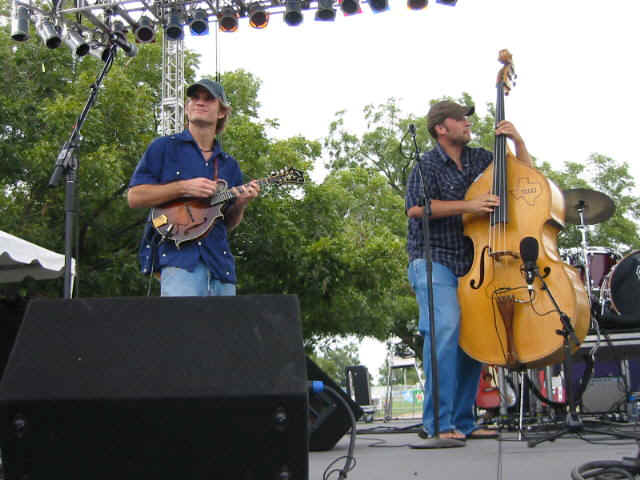
Locate an element on the screen. This screenshot has width=640, height=480. stage floor is located at coordinates (448, 461).